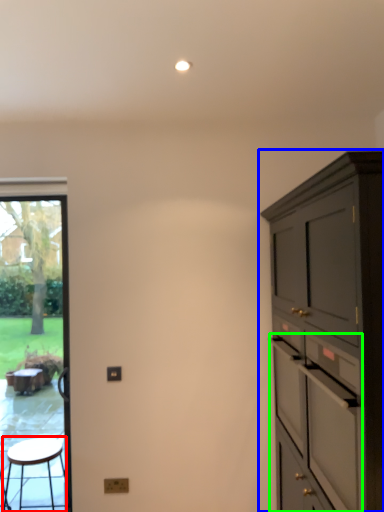
Question: Which object is positioned closest to stool (highlighted by a red box)? Select from cabinetry (highlighted by a blue box) and drawer (highlighted by a green box).

Choices:
 (A) cabinetry
 (B) drawer

Answer: (B)